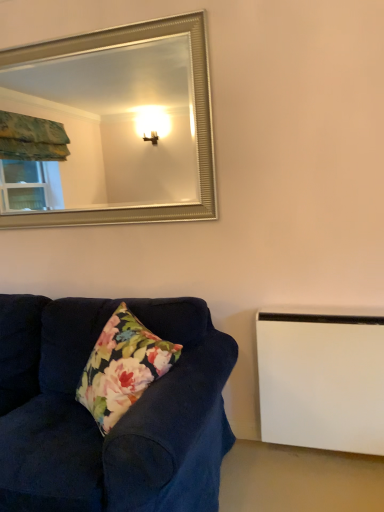
Question: Considering the relative positions of velvet dark blue couch at lower left and silver metallic mirror at upper center in the image provided, is velvet dark blue couch at lower left to the right of silver metallic mirror at upper center from the viewer's perspective?

Choices:
 (A) no
 (B) yes

Answer: (A)

Question: From a real-world perspective, does velvet dark blue couch at lower left sit lower than silver metallic mirror at upper center?

Choices:
 (A) no
 (B) yes

Answer: (B)

Question: From the image's perspective, does velvet dark blue couch at lower left appear lower than silver metallic mirror at upper center?

Choices:
 (A) no
 (B) yes

Answer: (B)

Question: Is velvet dark blue couch at lower left placed right next to silver metallic mirror at upper center?

Choices:
 (A) no
 (B) yes

Answer: (A)

Question: Is velvet dark blue couch at lower left not near silver metallic mirror at upper center?

Choices:
 (A) yes
 (B) no

Answer: (A)

Question: Choose the correct answer: Is silver metallic mirror at upper center inside velvet dark blue couch at lower left or outside it?

Choices:
 (A) outside
 (B) inside

Answer: (A)

Question: Relative to velvet dark blue couch at lower left, is silver metallic mirror at upper center in front or behind?

Choices:
 (A) front
 (B) behind

Answer: (B)

Question: From a real-world perspective, is silver metallic mirror at upper center above or below velvet dark blue couch at lower left?

Choices:
 (A) above
 (B) below

Answer: (A)

Question: From the image's perspective, is silver metallic mirror at upper center above or below velvet dark blue couch at lower left?

Choices:
 (A) below
 (B) above

Answer: (B)

Question: In terms of height, does white matte radiator at lower right look taller or shorter compared to velvet dark blue couch at lower left?

Choices:
 (A) short
 (B) tall

Answer: (A)

Question: Choose the correct answer: Is white matte radiator at lower right inside velvet dark blue couch at lower left or outside it?

Choices:
 (A) inside
 (B) outside

Answer: (B)

Question: Is white matte radiator at lower right in front of or behind velvet dark blue couch at lower left in the image?

Choices:
 (A) front
 (B) behind

Answer: (B)

Question: Is white matte radiator at lower right bigger or smaller than velvet dark blue couch at lower left?

Choices:
 (A) big
 (B) small

Answer: (B)

Question: Is velvet dark blue couch at lower left in front of or behind white matte radiator at lower right in the image?

Choices:
 (A) front
 (B) behind

Answer: (A)

Question: Looking at the image, does velvet dark blue couch at lower left seem bigger or smaller compared to white matte radiator at lower right?

Choices:
 (A) big
 (B) small

Answer: (A)